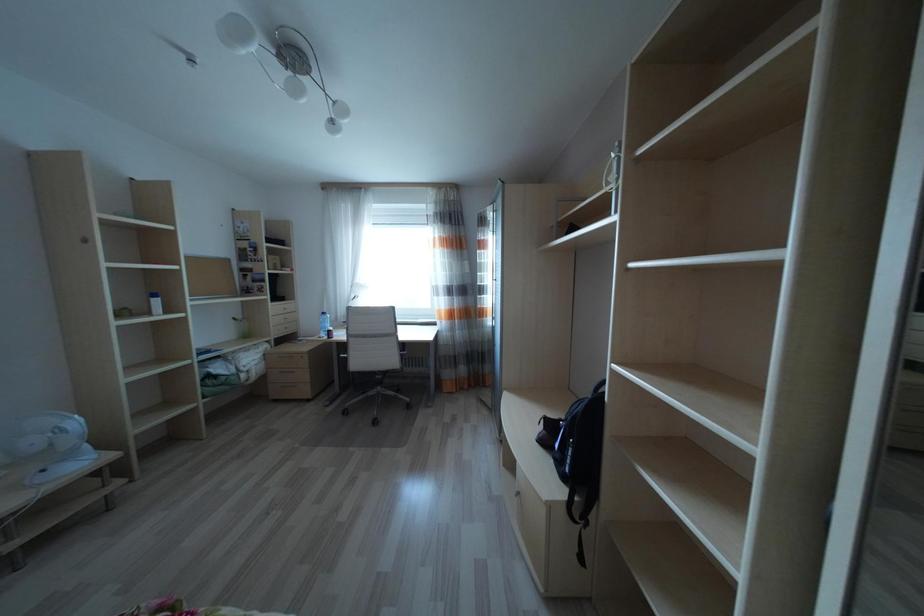
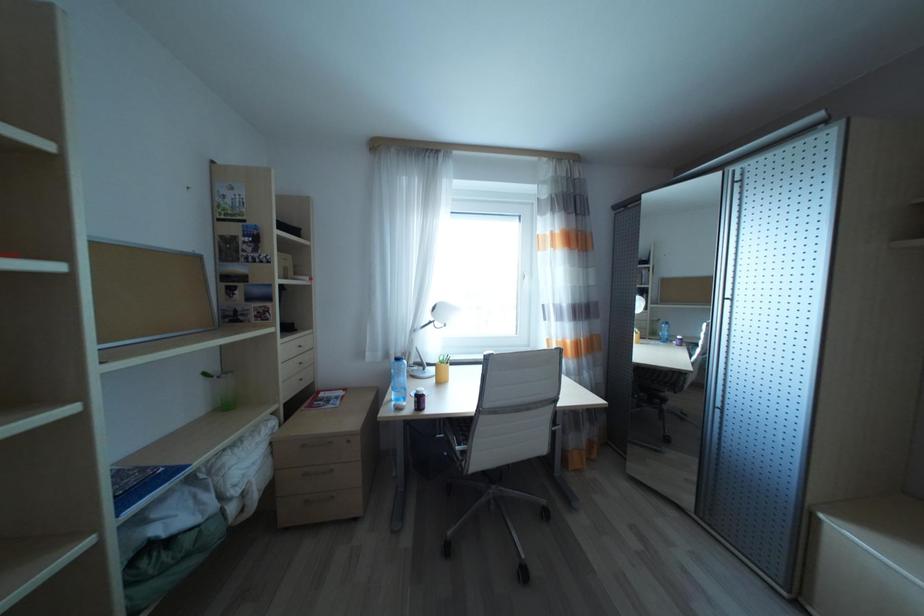
Which direction would the cameraman need to move to produce the second image?

The cameraman walked toward left, forward.